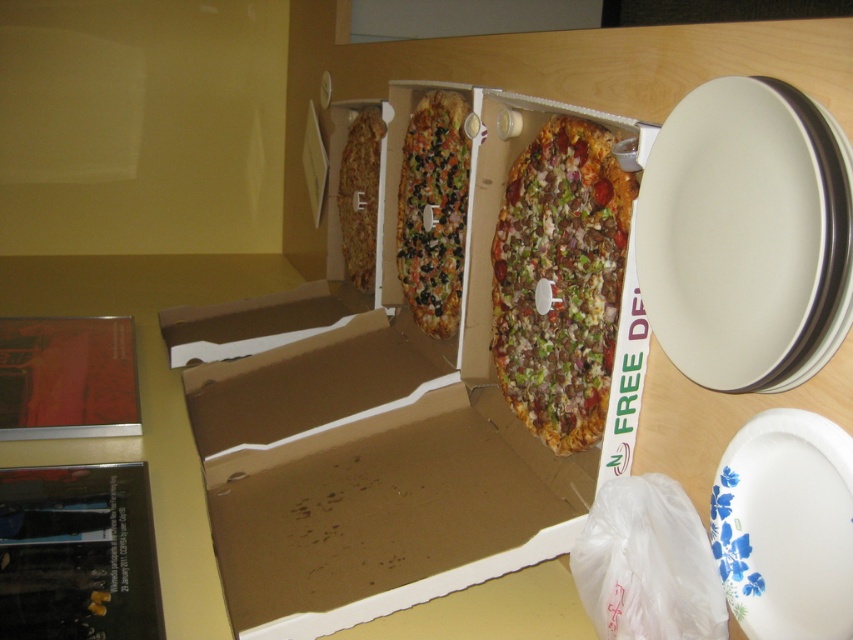
Question: Which of the following is the farthest from the observer?

Choices:
 (A) (351, 278)
 (B) (204, 449)

Answer: (A)

Question: Among these points, which one is nearest to the camera?

Choices:
 (A) (408, 154)
 (B) (288, 506)

Answer: (B)

Question: Does white glossy plate at upper right appear over crusty pizza slice at center?

Choices:
 (A) yes
 (B) no

Answer: (B)

Question: Is crusty pizza at center positioned in front of multicolored vegetable pizza at center?

Choices:
 (A) no
 (B) yes

Answer: (B)

Question: Is the position of brown cardboard box at center more distant than that of white glossy plate at upper right?

Choices:
 (A) yes
 (B) no

Answer: (A)

Question: Which of the following is the closest to the observer?

Choices:
 (A) crusty pizza at center
 (B) brown cardboard box at center

Answer: (B)